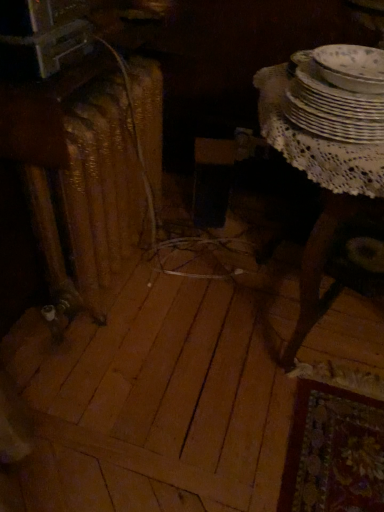
Question: Is rusty metal radiator at left surrounding white lace table at right?

Choices:
 (A) no
 (B) yes

Answer: (A)

Question: Does rusty metal radiator at left have a lesser height compared to white lace table at right?

Choices:
 (A) yes
 (B) no

Answer: (B)

Question: Is rusty metal radiator at left outside white lace table at right?

Choices:
 (A) no
 (B) yes

Answer: (B)

Question: Is rusty metal radiator at left oriented towards white lace table at right?

Choices:
 (A) no
 (B) yes

Answer: (B)

Question: Does rusty metal radiator at left appear on the left side of white lace table at right?

Choices:
 (A) yes
 (B) no

Answer: (A)

Question: Is rusty metal radiator at left far from white lace table at right?

Choices:
 (A) yes
 (B) no

Answer: (B)

Question: Is white porcelain plates at upper right, acting as the 2th tableware starting from the bottom, further to camera compared to rusty metal radiator at left?

Choices:
 (A) no
 (B) yes

Answer: (A)

Question: From the image's perspective, is white porcelain plates at upper right, acting as the 2th tableware starting from the bottom, located beneath rusty metal radiator at left?

Choices:
 (A) yes
 (B) no

Answer: (B)

Question: Does white porcelain plates at upper right, acting as the 2th tableware starting from the bottom, have a lesser height compared to rusty metal radiator at left?

Choices:
 (A) yes
 (B) no

Answer: (A)

Question: Is white porcelain plates at upper right, the first tableware viewed from the top, not inside rusty metal radiator at left?

Choices:
 (A) no
 (B) yes

Answer: (B)

Question: Would you say rusty metal radiator at left is part of white porcelain plates at upper right, the first tableware viewed from the top,'s contents?

Choices:
 (A) yes
 (B) no

Answer: (B)

Question: From a real-world perspective, is white porcelain plates at upper right, acting as the 2th tableware starting from the bottom, positioned under white lace table at right based on gravity?

Choices:
 (A) yes
 (B) no

Answer: (B)